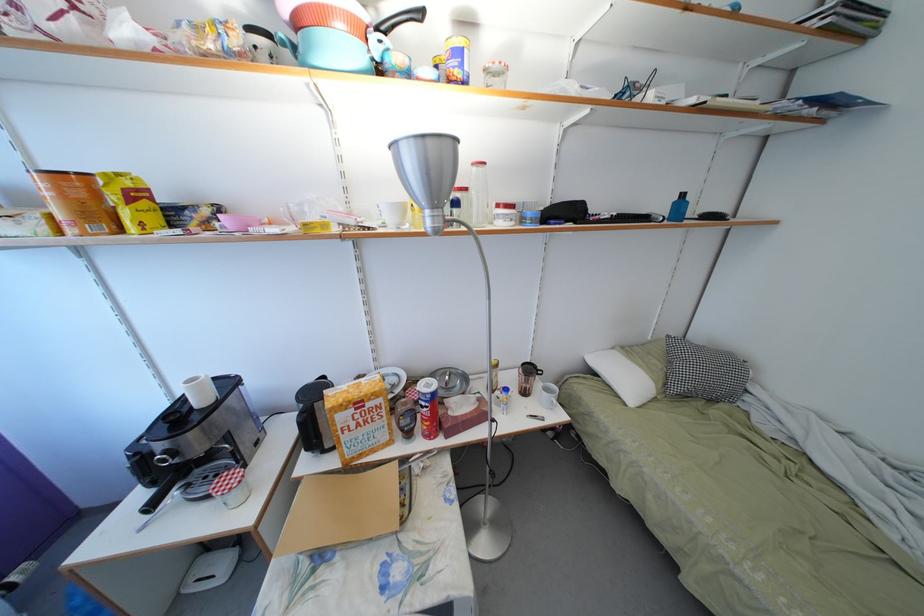
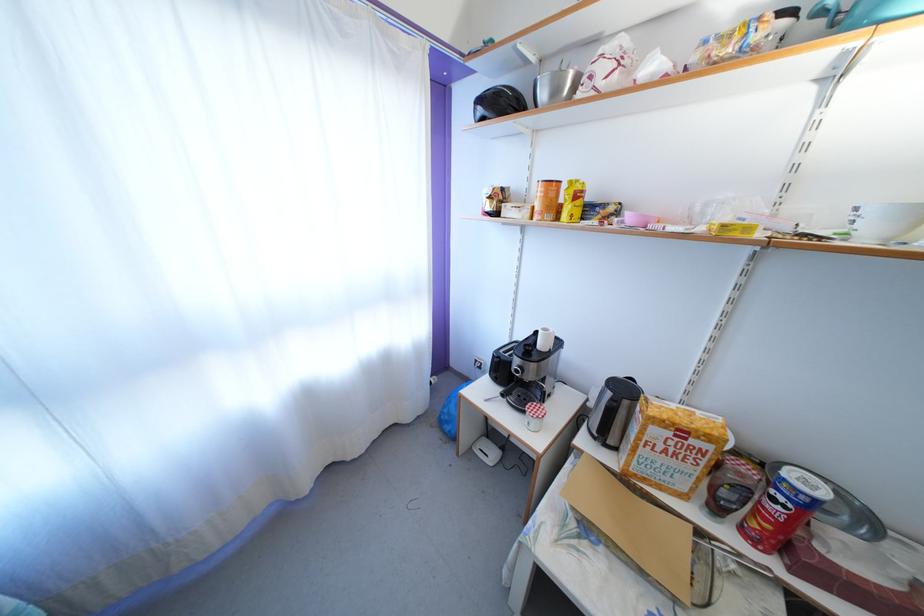
In the second image, find the point that corresponds to point (429, 408) in the first image.

(786, 505)